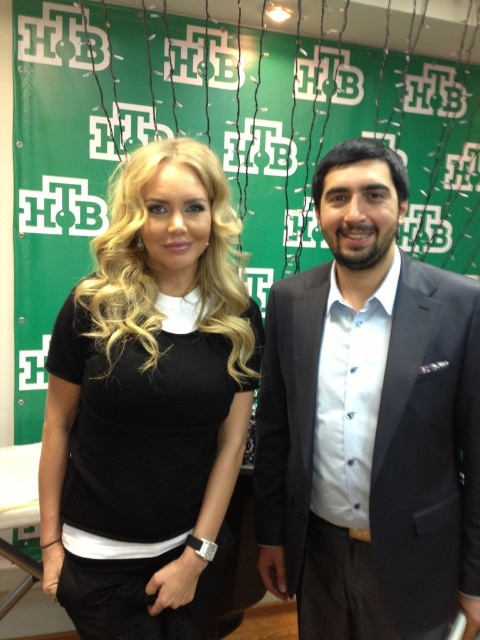
You are a photographer setting up for a group photo. You need to ensure that the green fabric bulletin board at upper center and the dark gray suit at center are both visible in the frame. Based on their heights, which object should be positioned closer to the camera to ensure both are fully visible?

The dark gray suit at center should be positioned closer to the camera because the green fabric bulletin board at upper center is taller. By placing the shorter dark gray suit closer, both objects can be accommodated within the frame without cropping either.